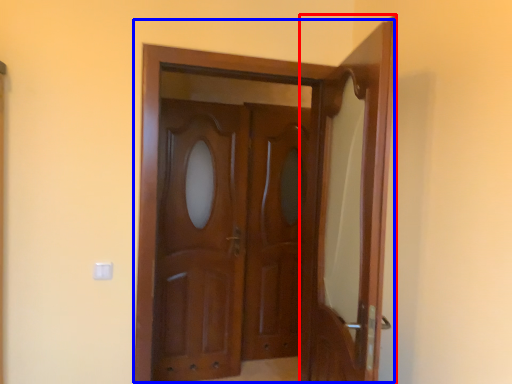
Question: Which object is closer to the camera taking this photo, door (highlighted by a red box) or door (highlighted by a blue box)?

Choices:
 (A) door
 (B) door

Answer: (A)